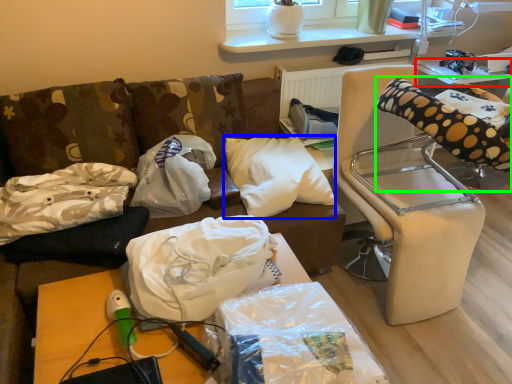
Question: Based on their relative distances, which object is nearer to table (highlighted by a red box)? Choose from pillow (highlighted by a blue box) and bean bag chair (highlighted by a green box).

Choices:
 (A) pillow
 (B) bean bag chair

Answer: (B)